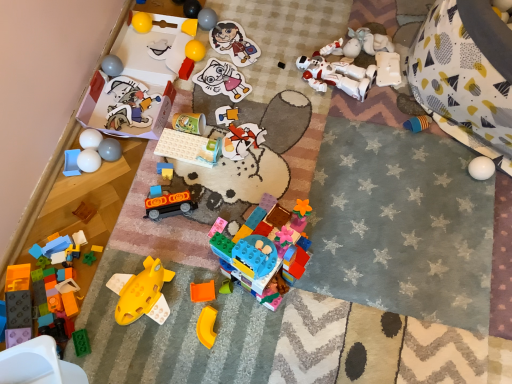
You are a GUI agent. You are given a task and a screenshot of the screen. Output one action in this format:
    pyautogui.click(x=<x>, y=<y>)
    Task: Click on the empty space that is in between yellow rubber ball at upper center, the tenth toy from the right, and matte plastic blocks at center, the 9th toy viewed from the left
    The height and width of the screenshot is (384, 512).
    Given the screenshot: What is the action you would take?
    pyautogui.click(x=181, y=114)